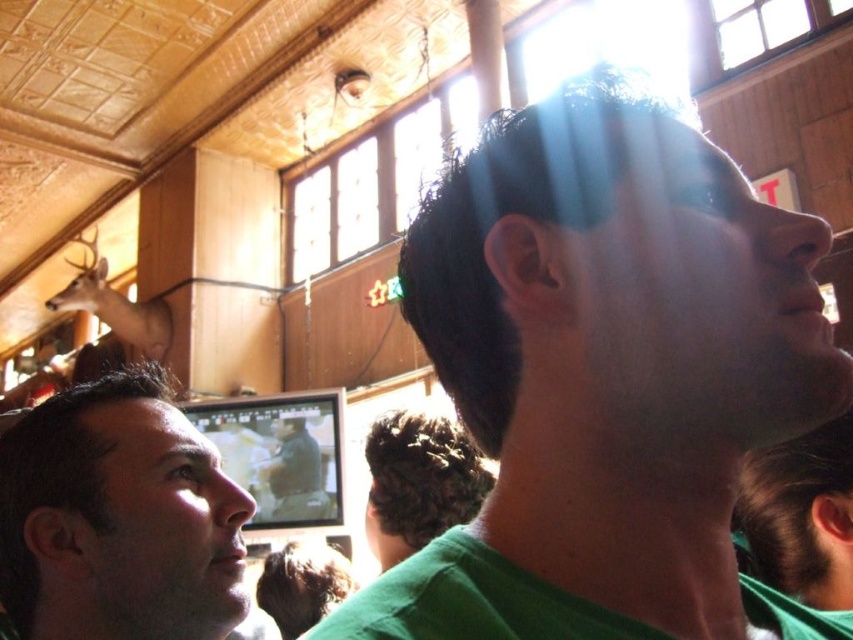
How far apart are matte green shirt at lower left and green matte shirt at center?

A distance of 31.42 inches exists between matte green shirt at lower left and green matte shirt at center.

The image size is (853, 640). Describe the element at coordinates (119, 518) in the screenshot. I see `matte green shirt at lower left` at that location.

The height and width of the screenshot is (640, 853). Describe the element at coordinates (119, 518) in the screenshot. I see `matte green shirt at lower left` at that location.

Locate an element on the screen. This screenshot has width=853, height=640. matte green shirt at lower left is located at coordinates (119, 518).

Which is below, green matte shirt at center or matte brown deer at center?

matte brown deer at center

Can you confirm if green matte shirt at center is smaller than matte brown deer at center?

Indeed, green matte shirt at center has a smaller size compared to matte brown deer at center.

Is point (773, 458) farther from camera compared to point (276, 474)?

That is False.

Find the location of a particular element. green matte shirt at center is located at coordinates (799, 516).

Who is positioned more to the left, green matte shirt at center or brown matte deer at upper left?

From the viewer's perspective, brown matte deer at upper left appears more on the left side.

Can you confirm if green matte shirt at center is positioned above brown matte deer at upper left?

No.

Is point (762, 477) farther from viewer compared to point (109, 321)?

No, it is in front of (109, 321).

The height and width of the screenshot is (640, 853). I want to click on green matte shirt at center, so click(799, 516).